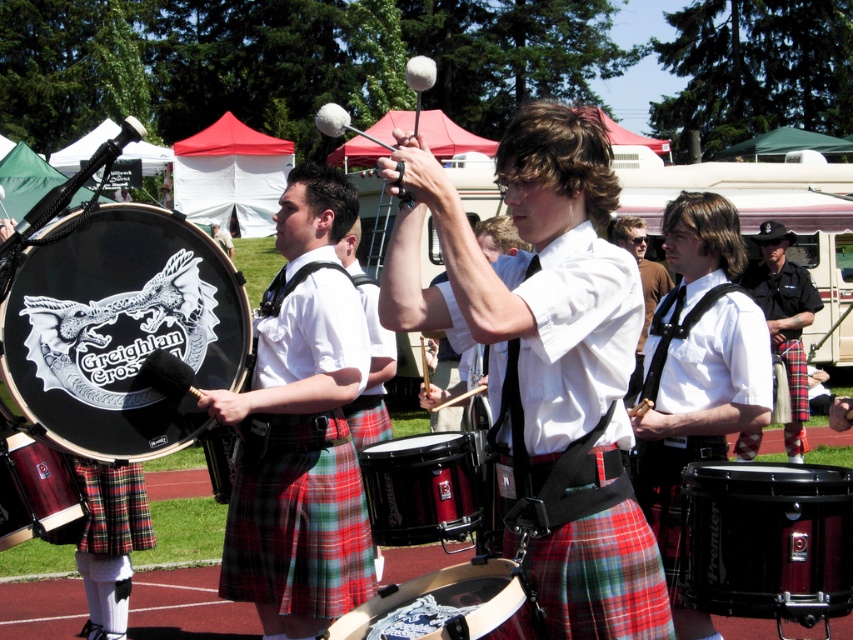
You are a photographer standing at the edge of the performance area. You need to capture a closeup shot of both the red plaid kilt at center and the matte black drum at center in the same frame. Can you position yourself so that both are visible without moving either object? Explain your reasoning.

The red plaid kilt at center and matte black drum at center are 1.31 meters apart from each other. Since the photographer can adjust their position and angle to frame both objects within the camera view, it is possible to capture both in the same shot without moving the objects.

You are a photographer trying to capture the shiny silver drum at center and the black leather hat at upper right in a single shot. Based on their positions, which object should you focus on first to ensure both are in frame?

The shiny silver drum at center is located below the black leather hat at upper right. To capture both in a single shot, focus on the black leather hat at upper right first, as it is positioned higher up, and adjust the camera angle downward to include the shiny silver drum at center below it.